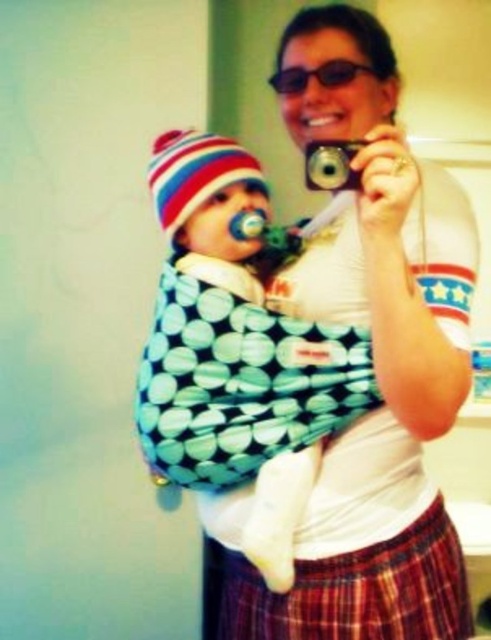
Question: Does plaid fabric kilt at lower center appear on the left side of matte black sunglasses at upper center?

Choices:
 (A) yes
 (B) no

Answer: (B)

Question: Estimate the real-world distances between objects in this image. Which object is farther from the matte black sunglasses at upper center?

Choices:
 (A) plaid fabric kilt at lower center
 (B) soft cotton baby carrier at center

Answer: (A)

Question: Which point appears closest to the camera in this image?

Choices:
 (A) (350, 620)
 (B) (277, 93)
 (C) (198, 381)

Answer: (A)

Question: Is soft cotton baby carrier at center positioned in front of plaid fabric kilt at lower center?

Choices:
 (A) no
 (B) yes

Answer: (A)

Question: Which point is closer to the camera taking this photo?

Choices:
 (A) (324, 76)
 (B) (230, 554)
 (C) (197, 300)

Answer: (C)

Question: Can you confirm if soft cotton baby carrier at center is positioned above plaid fabric kilt at lower center?

Choices:
 (A) no
 (B) yes

Answer: (B)